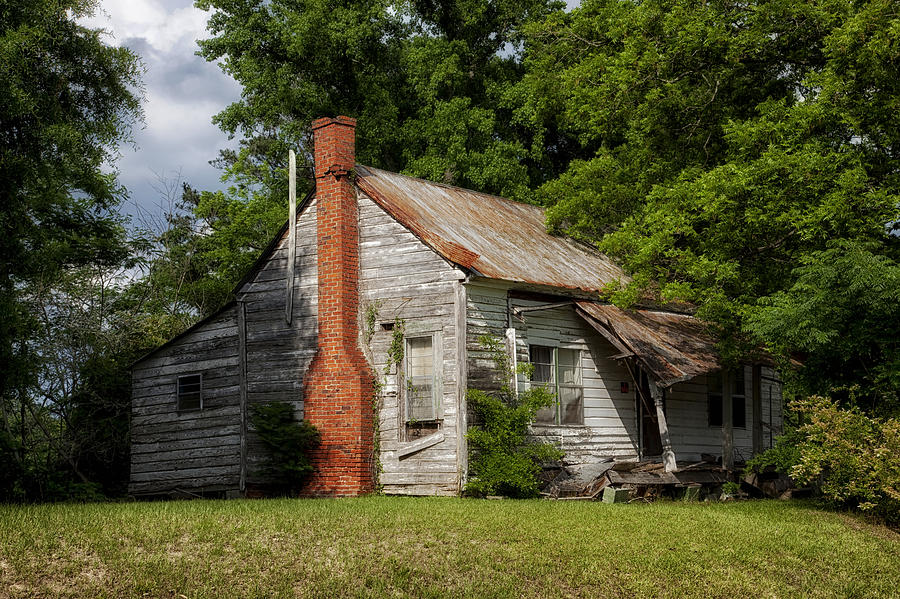
Where is `window`? window is located at coordinates (183, 398), (416, 380), (543, 389), (734, 414).